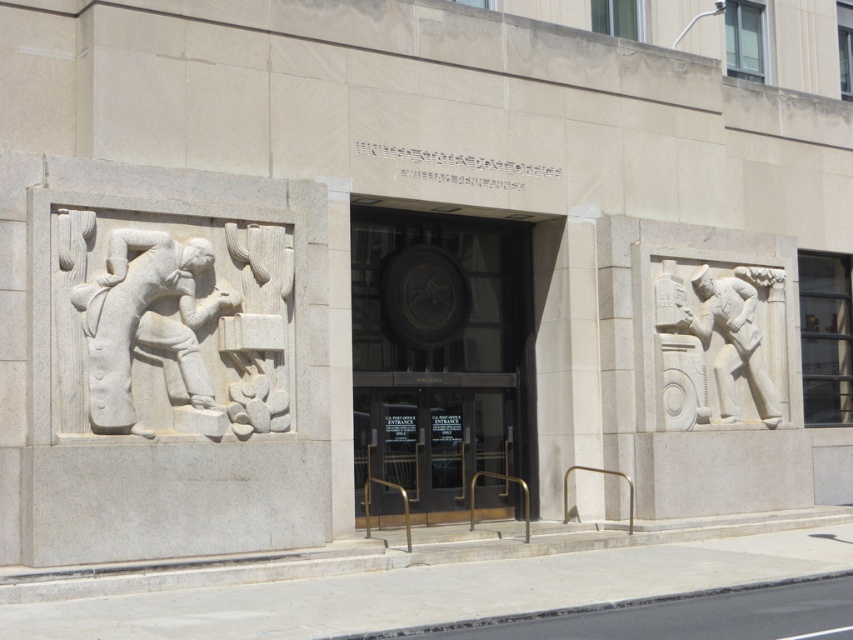
You are standing at the entrance of the building and want to take a photo of the relief sculpture on the left panel. The camera you have can focus on objects up to 20 meters away. Is the point at coordinates point (363, 284) within the camera focus range?

The distance of point (363, 284) from the viewer is 19.23 meters, which is within the camera focus range of up to 20 meters. Therefore, the camera can focus on the point (363, 284).

You are standing at the entrance of a government building and see the polished bronze door at center. If you want to reach the door, should you move forward or backward?

You should move forward to reach the polished bronze door at center since it is located at point 0.516 along the depth axis, which is closer to the entrance.

You are an architect designing a new building entrance. You want to ensure that the figures on both sides of the entrance are balanced in height. Given the white stone figure at left and the white stone figure at right, which one should you adjust to achieve this balance?

The white stone figure at left is shorter than the white stone figure at right. To balance their heights, you should increase the height of the white stone figure at left to match the taller white stone figure at right.